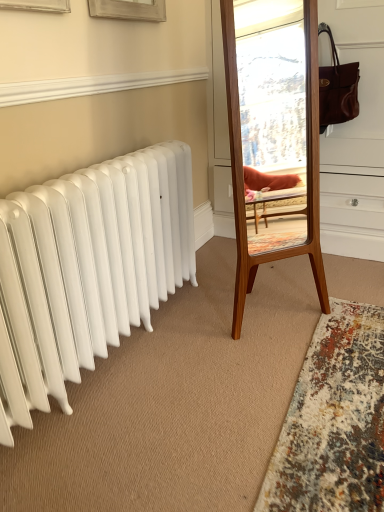
Question: Are multicolored shaggy rug at lower right and white smooth baseboard at upper center far apart?

Choices:
 (A) yes
 (B) no

Answer: (A)

Question: Is multicolored shaggy rug at lower right aimed at white smooth baseboard at upper center?

Choices:
 (A) yes
 (B) no

Answer: (B)

Question: Is multicolored shaggy rug at lower right not within white smooth baseboard at upper center?

Choices:
 (A) yes
 (B) no

Answer: (A)

Question: Does multicolored shaggy rug at lower right appear on the left side of white smooth baseboard at upper center?

Choices:
 (A) yes
 (B) no

Answer: (B)

Question: Is multicolored shaggy rug at lower right shorter than white smooth baseboard at upper center?

Choices:
 (A) yes
 (B) no

Answer: (A)

Question: From the image's perspective, is white smooth baseboard at upper center above or below multicolored shaggy rug at lower right?

Choices:
 (A) above
 (B) below

Answer: (A)

Question: Is white smooth baseboard at upper center bigger or smaller than multicolored shaggy rug at lower right?

Choices:
 (A) big
 (B) small

Answer: (B)

Question: Relative to multicolored shaggy rug at lower right, is white smooth baseboard at upper center in front or behind?

Choices:
 (A) behind
 (B) front

Answer: (A)

Question: In the image, is white smooth baseboard at upper center on the left side or the right side of multicolored shaggy rug at lower right?

Choices:
 (A) left
 (B) right

Answer: (A)

Question: In terms of height, does wooden mirror at center look taller or shorter compared to multicolored shaggy rug at lower right?

Choices:
 (A) short
 (B) tall

Answer: (B)

Question: Considering the positions of point (251, 289) and point (342, 359), is point (251, 289) closer or farther from the camera than point (342, 359)?

Choices:
 (A) closer
 (B) farther

Answer: (B)

Question: Is wooden mirror at center spatially inside multicolored shaggy rug at lower right, or outside of it?

Choices:
 (A) outside
 (B) inside

Answer: (A)

Question: Is wooden mirror at center in front of or behind multicolored shaggy rug at lower right in the image?

Choices:
 (A) front
 (B) behind

Answer: (B)

Question: Based on their positions, is wooden mirror at center located to the left or right of white smooth baseboard at upper center?

Choices:
 (A) left
 (B) right

Answer: (B)

Question: Is wooden mirror at center bigger or smaller than white smooth baseboard at upper center?

Choices:
 (A) small
 (B) big

Answer: (B)